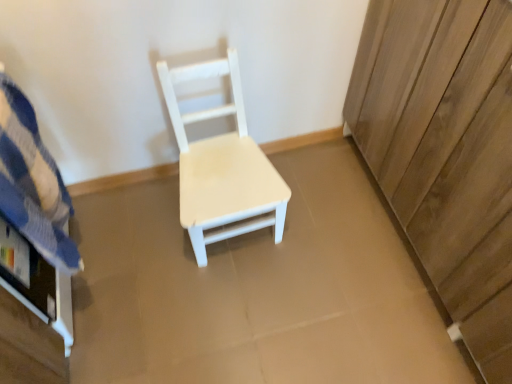
Question: In the image, is white matte wood chair at center on the left side or the right side of wooden dresser at right?

Choices:
 (A) right
 (B) left

Answer: (B)

Question: Considering their positions, is white matte wood chair at center located in front of or behind wooden dresser at right?

Choices:
 (A) front
 (B) behind

Answer: (B)

Question: Which object is the farthest from the white matte wood chair at center?

Choices:
 (A) blue striped fabric at left
 (B) wooden dresser at right

Answer: (B)

Question: Estimate the real-world distances between objects in this image. Which object is closer to the white matte wood chair at center?

Choices:
 (A) wooden dresser at right
 (B) blue striped fabric at left

Answer: (B)